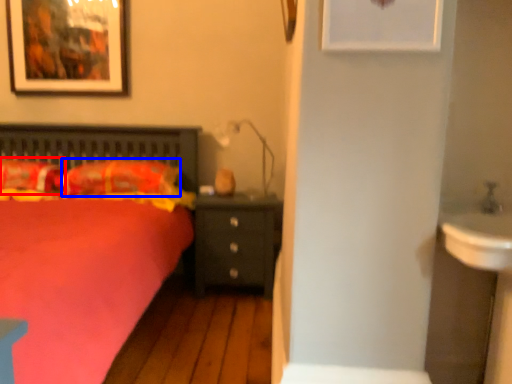
Question: Which object is further to the camera taking this photo, pillow (highlighted by a red box) or pillow (highlighted by a blue box)?

Choices:
 (A) pillow
 (B) pillow

Answer: (B)